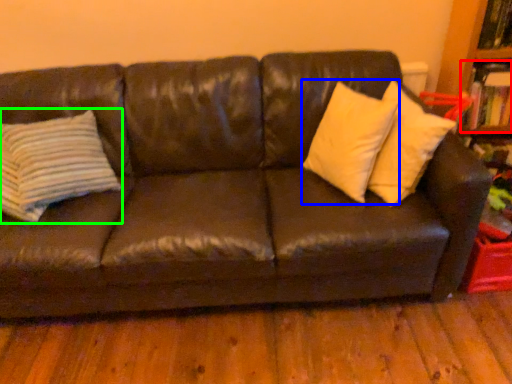
Question: Which is nearer to the book (highlighted by a red box)? pillow (highlighted by a blue box) or pillow (highlighted by a green box).

Choices:
 (A) pillow
 (B) pillow

Answer: (A)